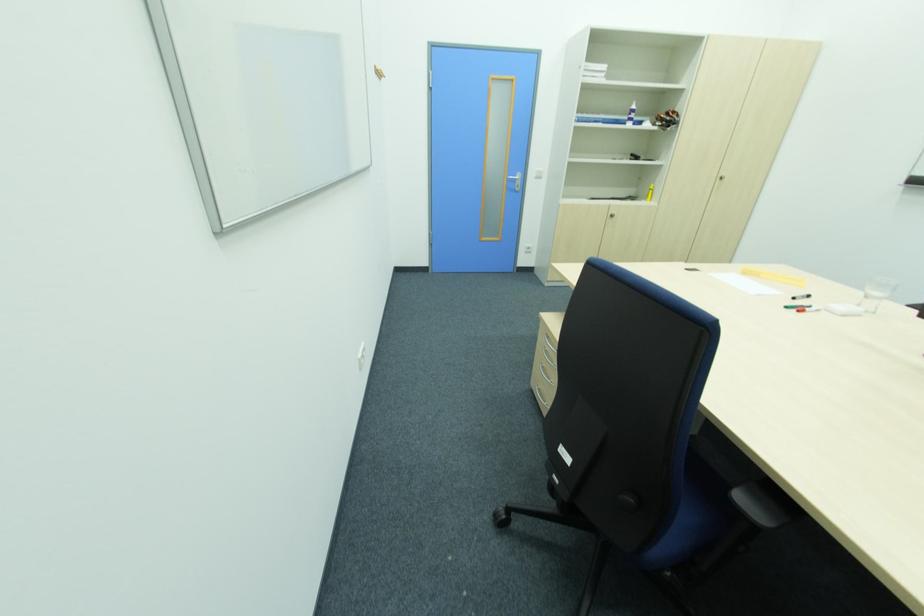
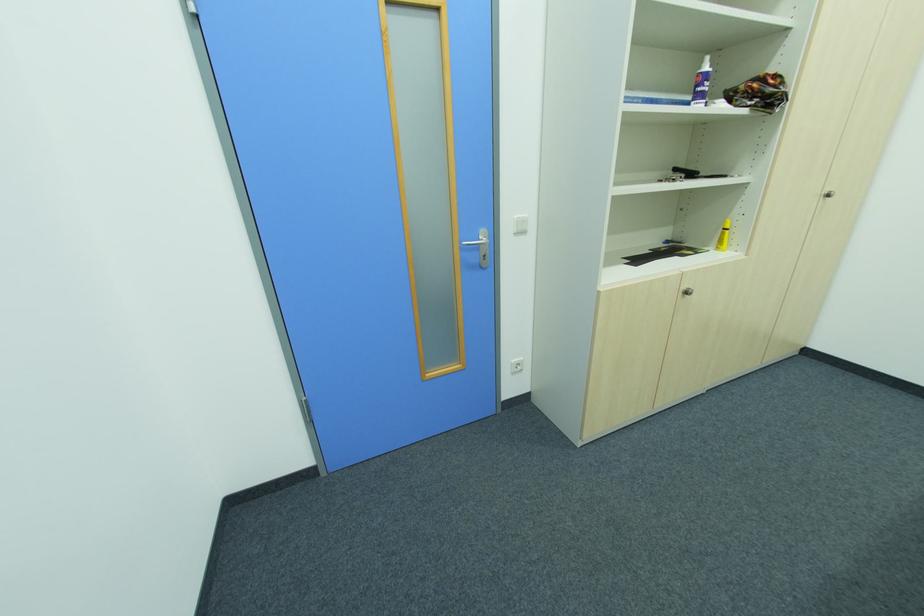
Locate, in the second image, the point that corresponds to [653,190] in the first image.

(728, 230)